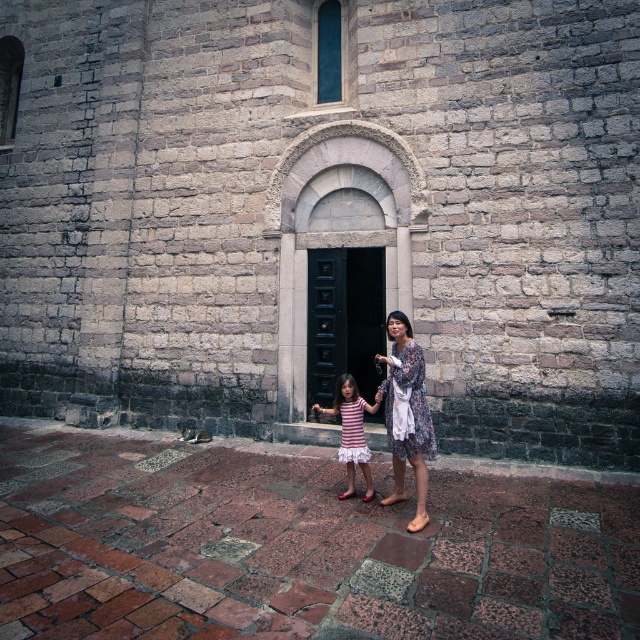
Question: Is gray stone church at center bigger than floral dress at center?

Choices:
 (A) yes
 (B) no

Answer: (A)

Question: Is gray stone church at center below striped fabric dress at center?

Choices:
 (A) yes
 (B) no

Answer: (B)

Question: Which object is farther from the camera taking this photo?

Choices:
 (A) floral dress at center
 (B) striped fabric dress at center
 (C) gray stone church at center

Answer: (C)

Question: Is the position of black wooden door at center less distant than that of striped fabric dress at center?

Choices:
 (A) yes
 (B) no

Answer: (B)

Question: Among these objects, which one is nearest to the camera?

Choices:
 (A) striped fabric dress at center
 (B) gray stone church at center
 (C) black wooden door at center

Answer: (A)

Question: Among these objects, which one is nearest to the camera?

Choices:
 (A) black wooden door at center
 (B) floral dress at center

Answer: (B)